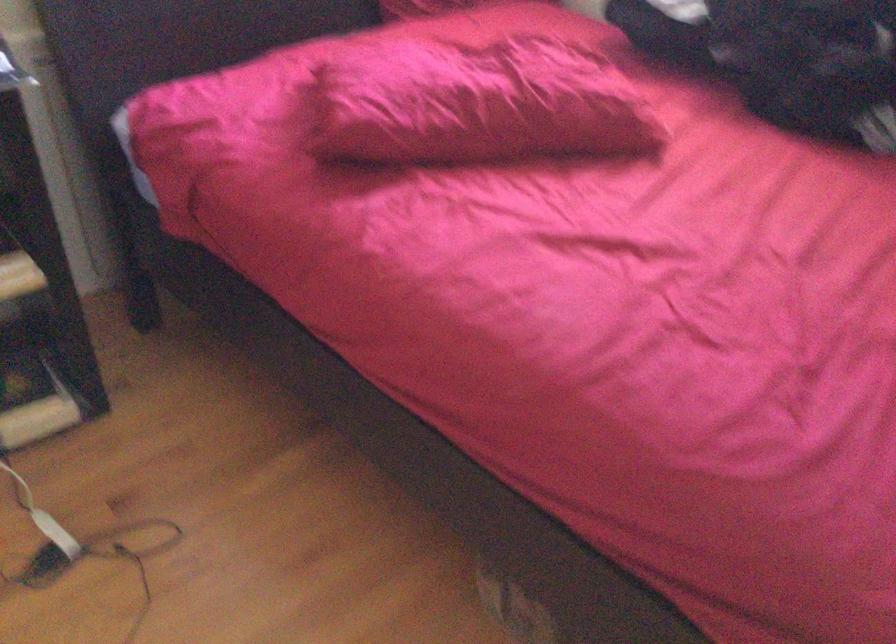
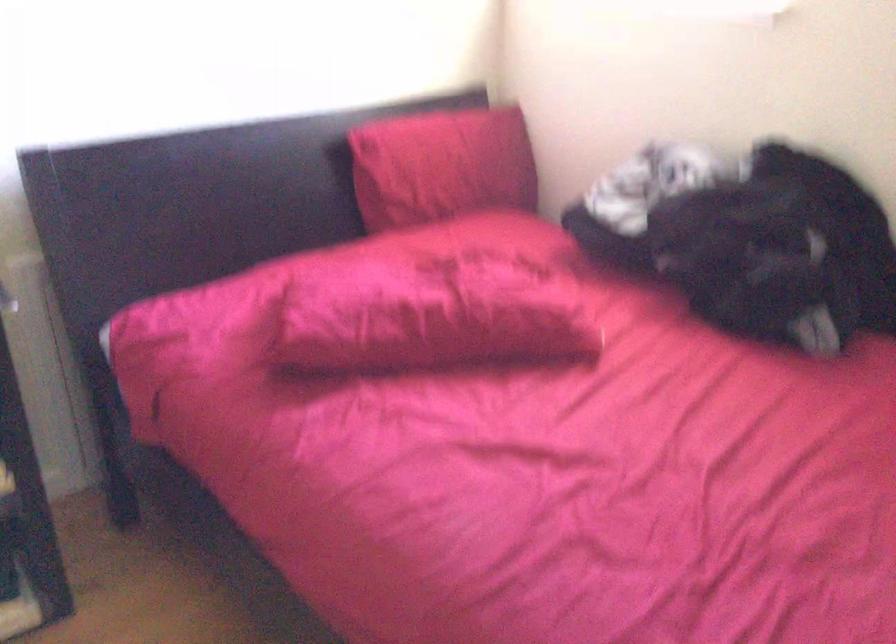
Where in the second image is the point corresponding to point (492, 104) from the first image?

(431, 316)